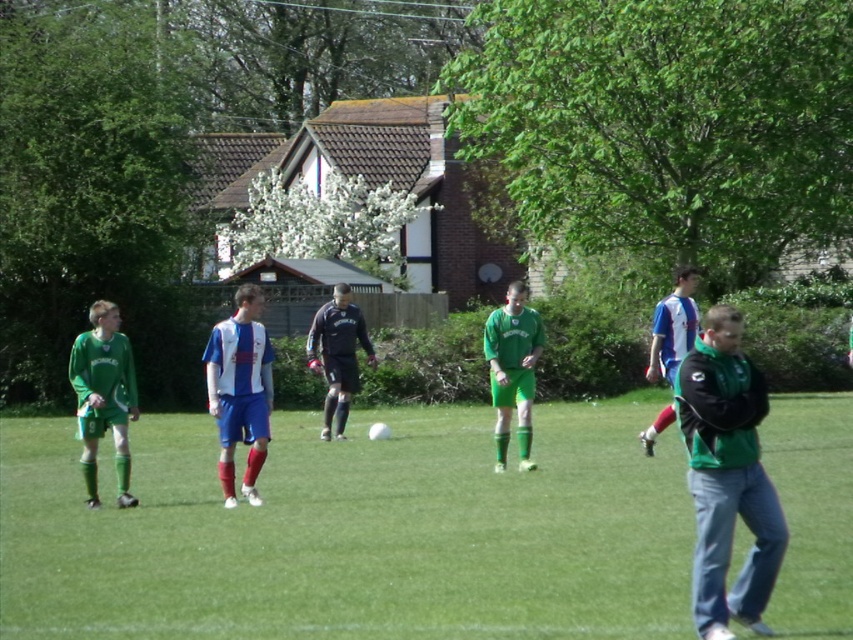
Is dark blue jersey at center smaller than blue and white jersey at center?

Incorrect, dark blue jersey at center is not smaller in size than blue and white jersey at center.

The height and width of the screenshot is (640, 853). What are the coordinates of `dark blue jersey at center` in the screenshot? It's located at (337, 355).

Who is lower down, green grass football field at center or dark blue jersey at center?

green grass football field at center is lower down.

Is point (535, 532) positioned behind point (318, 333)?

That is False.

Does point (33, 500) come in front of point (357, 390)?

Yes.

You are a GUI agent. You are given a task and a screenshot of the screen. Output one action in this format:
    pyautogui.click(x=<x>, y=<y>)
    Task: Click on the green grass football field at center
    The width and height of the screenshot is (853, 640).
    Given the screenshot: What is the action you would take?
    pyautogui.click(x=354, y=532)

Does green grass football field at center come in front of white jersey at center?

Yes, it is.

Can you confirm if green grass football field at center is positioned above white jersey at center?

No.

Is point (767, 605) behind point (229, 352)?

That is False.

Identify the location of green grass football field at center. The height and width of the screenshot is (640, 853). click(354, 532).